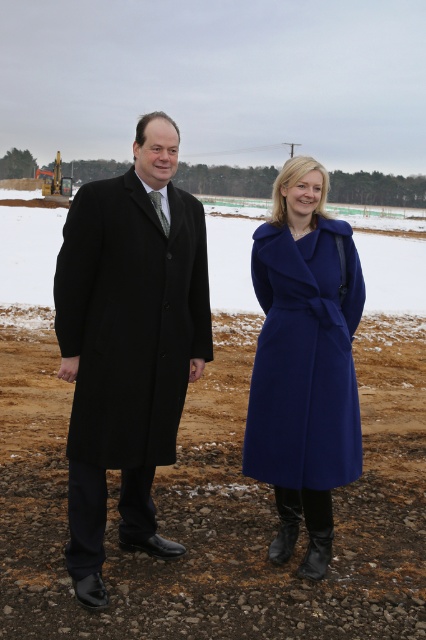
Measure the distance between brown gravel at center and matte blue coat at center.

5.53 feet

Is brown gravel at center taller than matte blue coat at center?

Incorrect, brown gravel at center's height is not larger of matte blue coat at center's.

The image size is (426, 640). I want to click on brown gravel at center, so click(x=218, y=506).

The image size is (426, 640). I want to click on brown gravel at center, so click(x=218, y=506).

Is brown gravel at center taller than black wool coat at center?

No, brown gravel at center is not taller than black wool coat at center.

Does brown gravel at center have a lesser width compared to black wool coat at center?

Yes.

The width and height of the screenshot is (426, 640). What are the coordinates of `brown gravel at center` in the screenshot? It's located at (218, 506).

Who is more forward, (100, 378) or (302, 273)?

Point (100, 378)

Between black wool coat at center and matte blue coat at center, which one appears on the right side from the viewer's perspective?

matte blue coat at center

Which is in front, point (129, 417) or point (293, 278)?

Point (129, 417) is more forward.

Where is `black wool coat at center`? black wool coat at center is located at coordinates (129, 342).